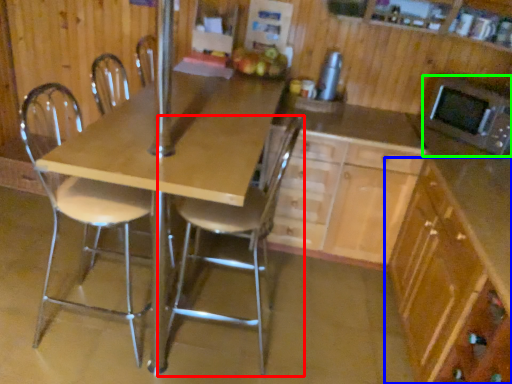
Question: Considering the real-world distances, which object is farthest from chair (highlighted by a red box)? cabinetry (highlighted by a blue box) or microwave oven (highlighted by a green box)?

Choices:
 (A) cabinetry
 (B) microwave oven

Answer: (B)